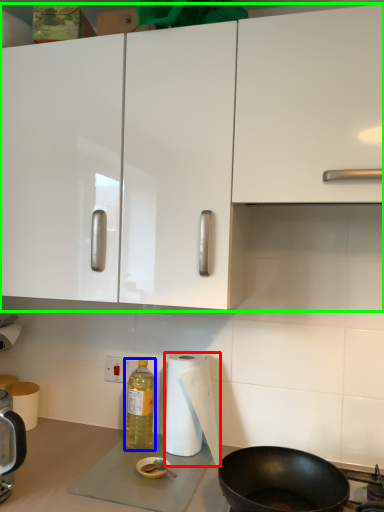
Question: Which is nearer to the paper towel (highlighted by a red box)? bottle (highlighted by a blue box) or cabinetry (highlighted by a green box).

Choices:
 (A) bottle
 (B) cabinetry

Answer: (A)